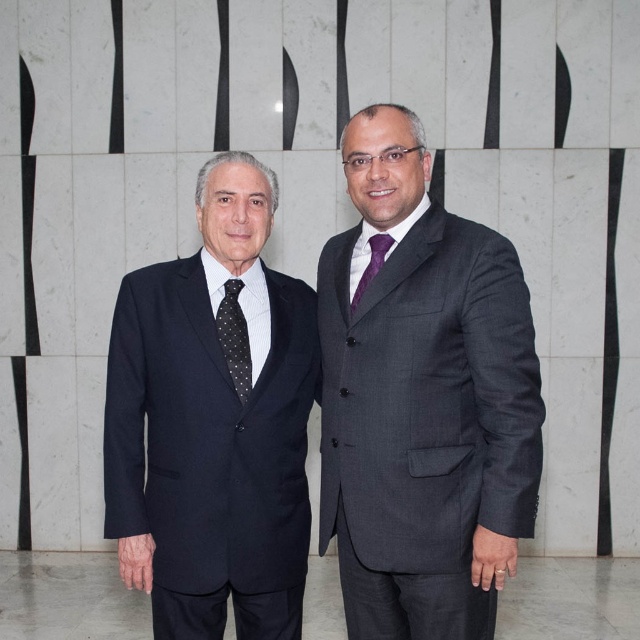
You are a tailor observing two men in suits. The black dotted tie at left and the purple satin tie at center are both visible. Which tie is taller?

The black dotted tie at left is taller than the purple satin tie at center.

You are a photographer trying to capture the two men in the scene. You need to ensure that the dark gray suit at center and the black dotted tie at left are both visible in the frame. Based on their positions, which one should you focus on first to ensure both are in the shot?

The dark gray suit at center is positioned on the right side of the black dotted tie at left. To ensure both are in the frame, focus on the black dotted tie at left first, as it is closer to the left edge, allowing the dark gray suit at center to be captured to its right.

You are a photographer setting up for a portrait. You need to ensure that the matte black suit at left and the purple satin tie at center are both in focus. Based on their positions, which one should you adjust your camera focus to prioritize for optimal clarity?

The matte black suit at left is closer to the viewer than the purple satin tie at center. To ensure both are in focus, prioritize focusing on the matte black suit at left since it is nearer, and the depth of field will naturally extend to the farther object.